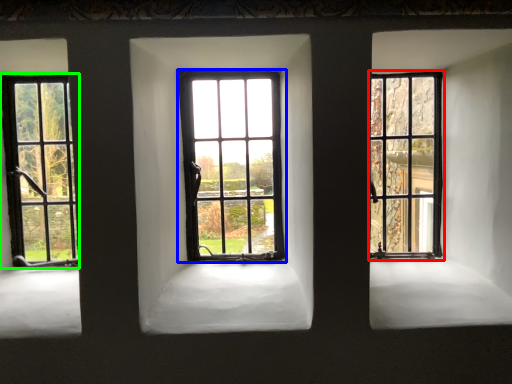
Question: Which object is the farthest from window (highlighted by a red box)? Choose among these: window (highlighted by a blue box) or window (highlighted by a green box).

Choices:
 (A) window
 (B) window

Answer: (B)